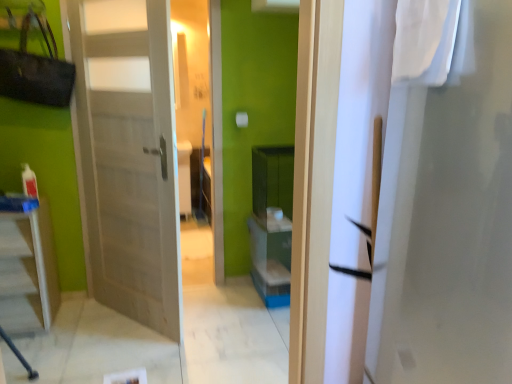
Question: From a real-world perspective, is wooden door at left positioned above or below white glossy table at lower left?

Choices:
 (A) below
 (B) above

Answer: (B)

Question: Is wooden door at left inside the boundaries of white glossy table at lower left, or outside?

Choices:
 (A) inside
 (B) outside

Answer: (B)

Question: Estimate the real-world distances between objects in this image. Which object is closer to the white fabric at upper right?

Choices:
 (A) wooden door at left
 (B) white glossy table at lower left

Answer: (A)

Question: Which of these objects is positioned farthest from the white glossy table at lower left?

Choices:
 (A) white fabric at upper right
 (B) wooden door at left

Answer: (A)